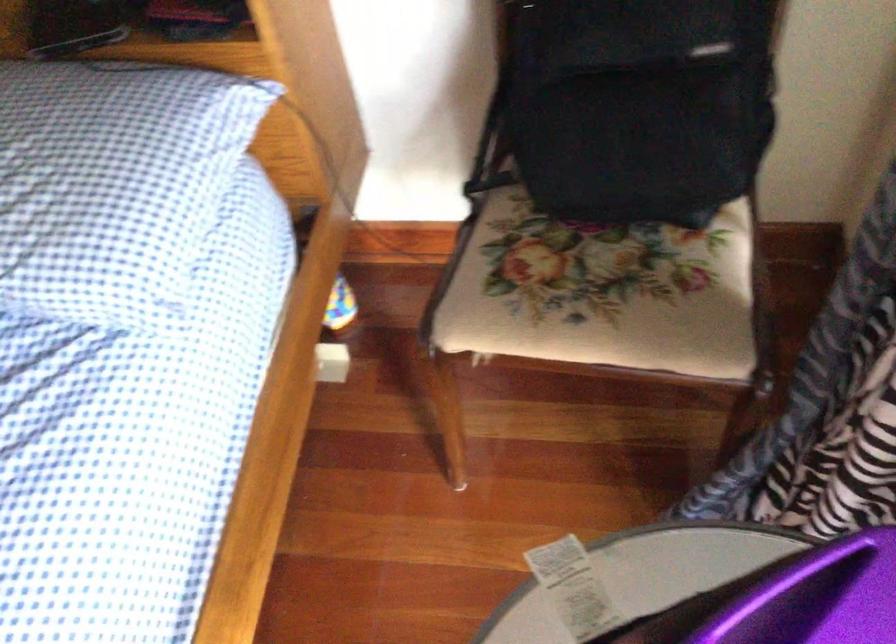
Find where to sit the floral chair sitting surface. Please return your answer as a coordinate pair (x, y).

(599, 292)